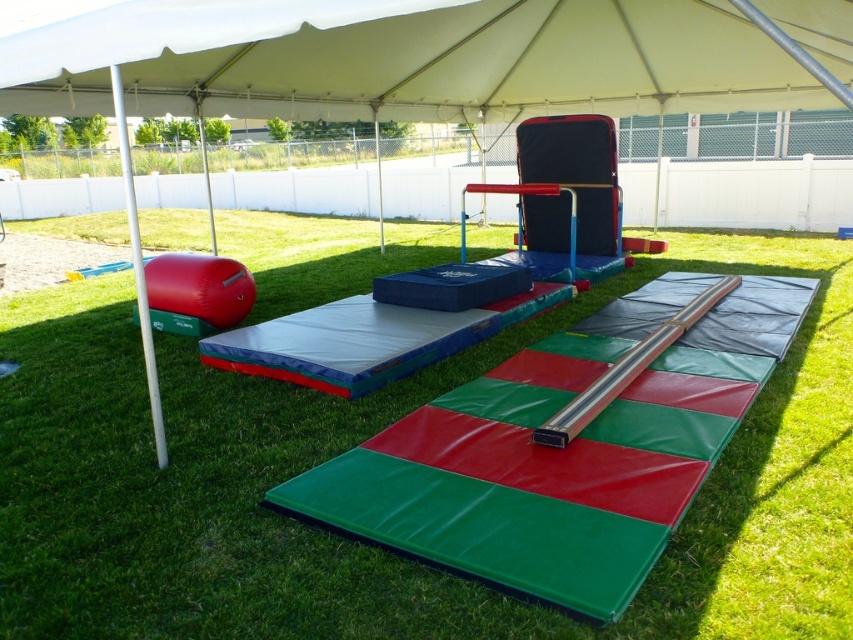
You are a photographer standing outside the tent and want to capture both the white fabric tent at center and the white fabric canopy at upper center in a single photo. However, your camera has a limited depth of field. Which object will be in focus if you focus on the closer one?

The white fabric tent at center will be in focus because it is closer to the photographer than the white fabric canopy at upper center.

You are a visitor standing under the white fabric canopy at upper center and want to walk towards the white fabric tent at center. Is the tent wider than the canopy above you?

The white fabric tent at center is wider than the white fabric canopy at upper center, so yes, the tent is wider than the canopy above you.